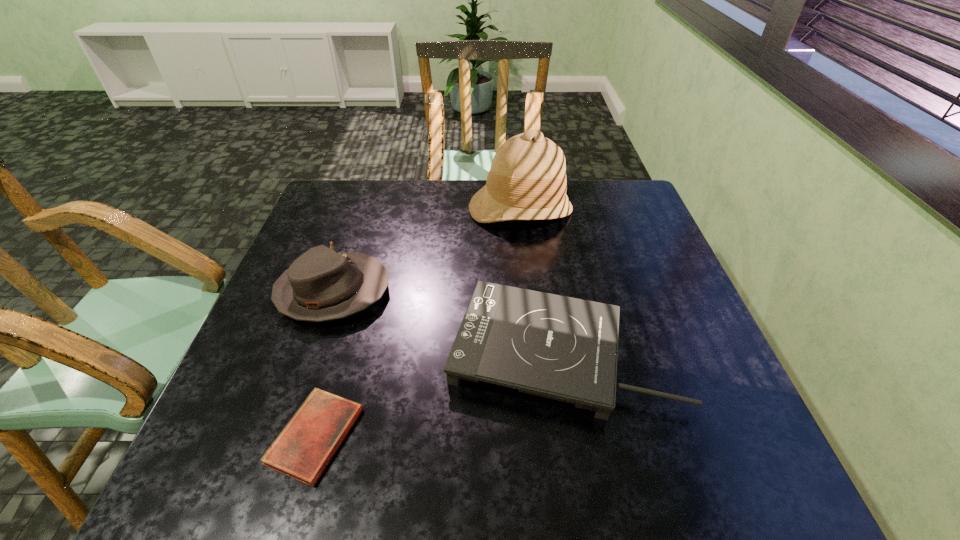
The width and height of the screenshot is (960, 540). What are the coordinates of `the taller hat` in the screenshot? It's located at (527, 181).

This screenshot has width=960, height=540. I want to click on the tallest object, so click(x=527, y=181).

At what (x,y) coordinates should I click in order to perform the action: click on the left hat. Please return your answer as a coordinate pair (x, y). The image size is (960, 540). Looking at the image, I should click on (320, 285).

The image size is (960, 540). I want to click on the third shortest object, so (320, 285).

Where is `the third tallest object`? This screenshot has height=540, width=960. the third tallest object is located at coordinates (562, 348).

Image resolution: width=960 pixels, height=540 pixels. I want to click on diary, so click(x=303, y=449).

You are a GUI agent. You are given a task and a screenshot of the screen. Output one action in this format:
    pyautogui.click(x=<x>, y=<y>)
    Task: Click on the blank space located 0.200m on the front-facing side of the right hat
    
    Given the screenshot: What is the action you would take?
    click(x=529, y=282)

The height and width of the screenshot is (540, 960). What are the coordinates of `vacant position located 0.060m on the decorative side of the left hat` in the screenshot? It's located at (414, 292).

Identify the location of vacant space positioned 0.300m on the left of the third tallest object. (311, 351).

This screenshot has width=960, height=540. I want to click on vacant space located on the right of the shortest object, so click(557, 436).